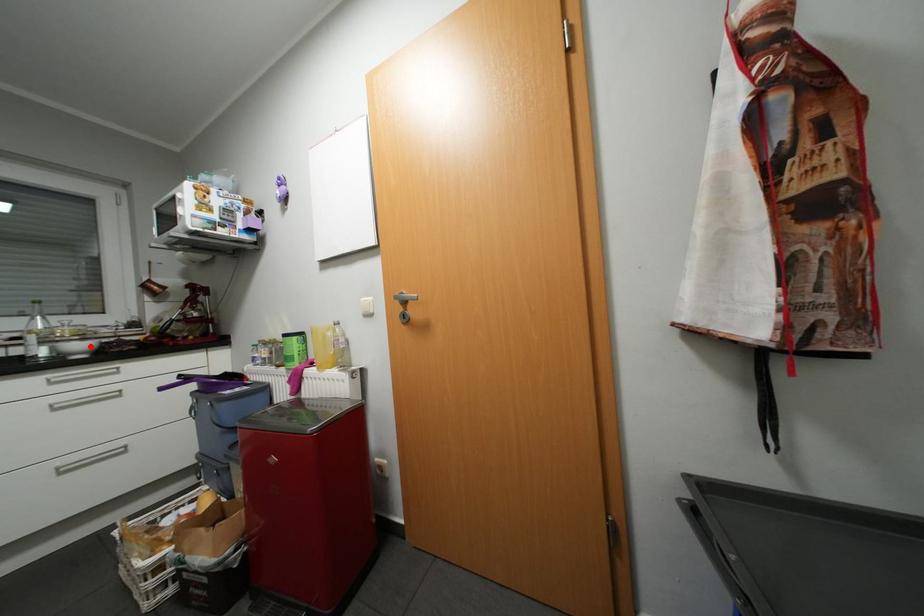
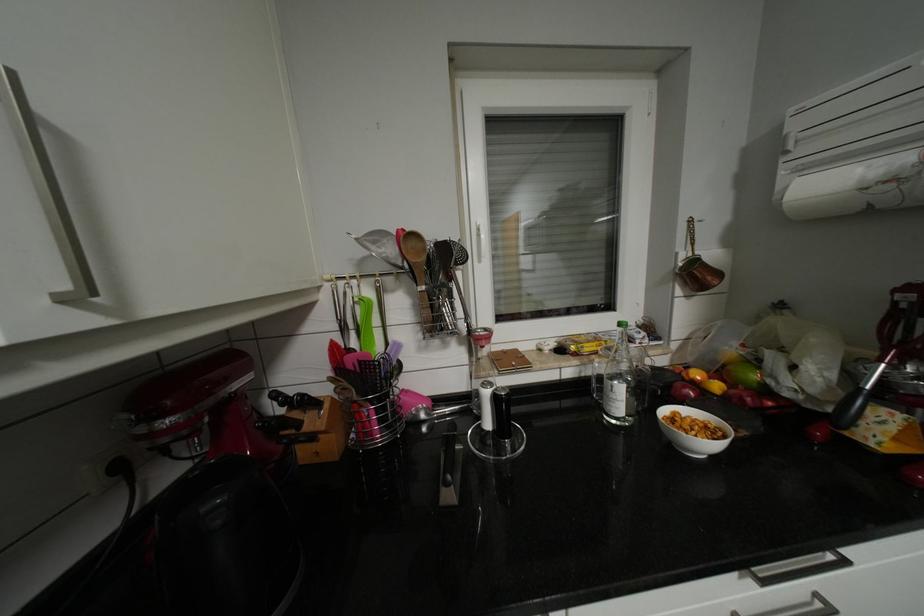
Where in the second image is the point corresponding to the highlighted location from the first image?

(703, 430)